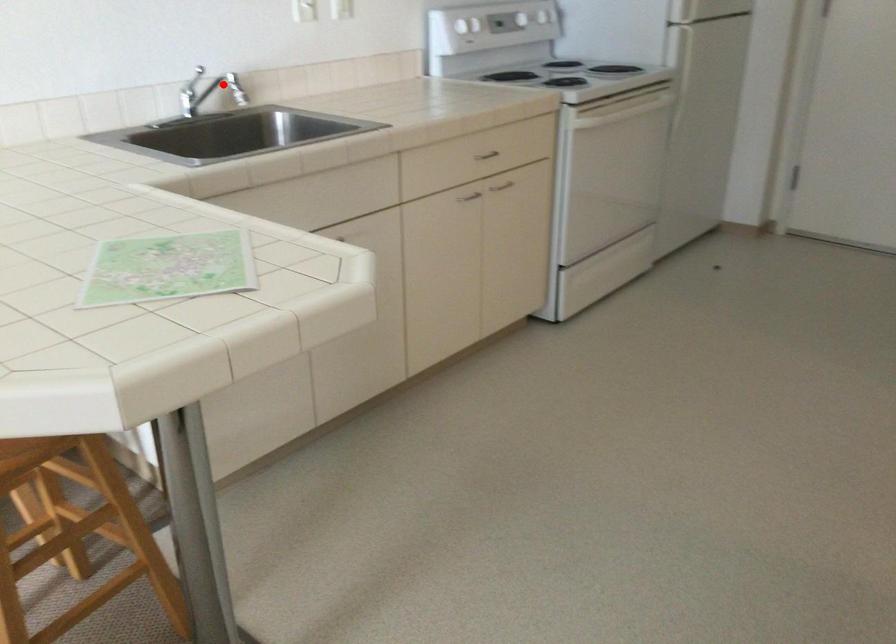
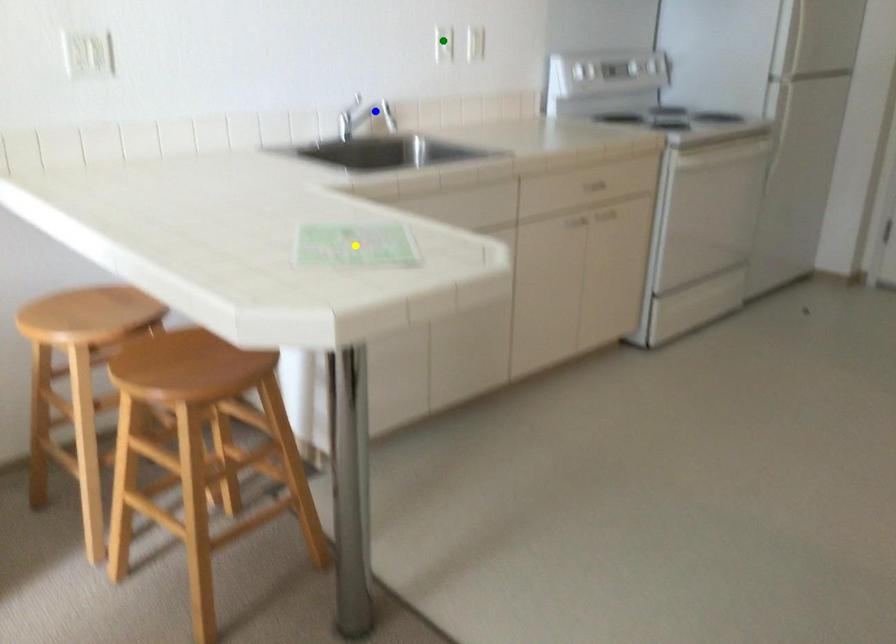
Question: I am providing you with two images of the same scene from different viewpoints. A red point is marked on the first image. You are given multiple points on the second image. Can you choose the point in image 2 that corresponds to the point in image 1?

Choices:
 (A) blue point
 (B) yellow point
 (C) green point

Answer: (A)